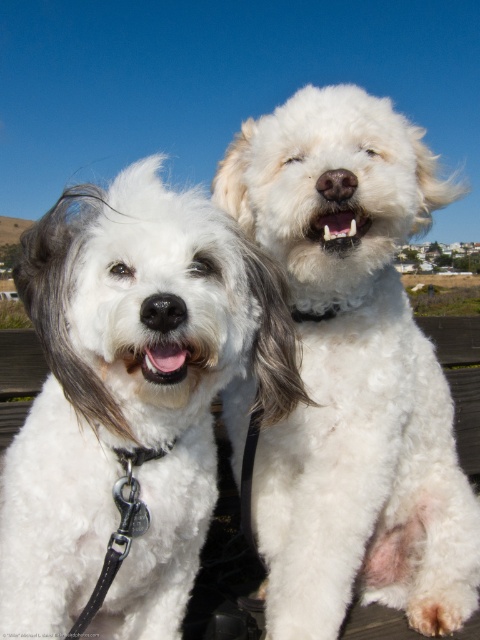
Can you confirm if white fluffy dog at right is positioned to the right of white fluffy dog at center?

Indeed, white fluffy dog at right is positioned on the right side of white fluffy dog at center.

Is point (355, 250) positioned behind point (28, 550)?

That is True.

This screenshot has width=480, height=640. Identify the location of white fluffy dog at right. (352, 372).